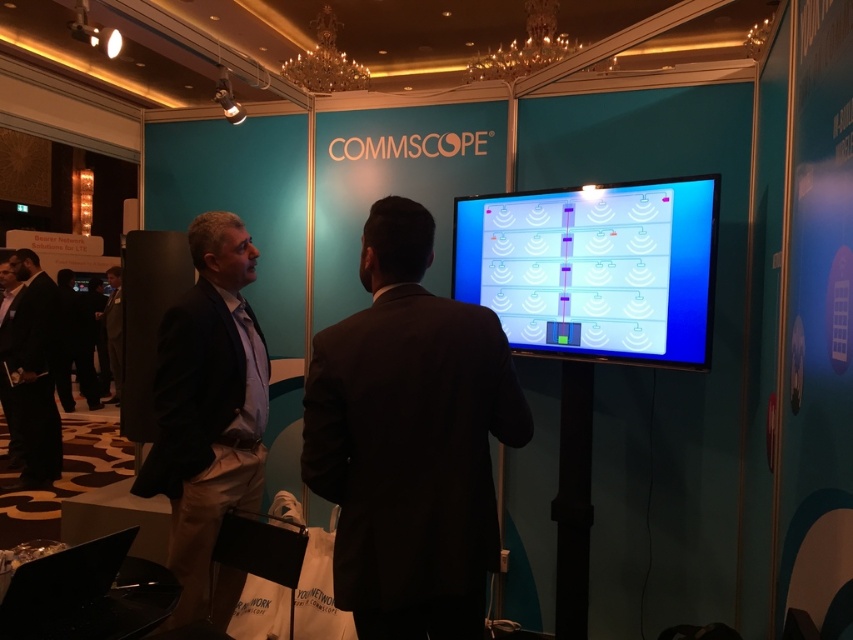
You are a security guard at the trade show and need to ensure that attendees are maintaining a safe distance of at least 3 meters apart. You observe two people wearing dark brown suit at left and black suit at left. Are they complying with the social distancing guidelines?

The distance between the dark brown suit at left and black suit at left is 3.59 meters, which exceeds the required 3 meters. Therefore, they are complying with the social distancing guidelines.

You are at the Commscope booth and want to see the diagram on the blue glossy screen at center while also checking your notes on the black fabric pants at lower left. Can you do both at the same time without moving your head?

The blue glossy screen at center is positioned on the right side of black fabric pants at lower left, so if you are facing the screen, the pants would be to your left. You can see both by glancing sideways without moving your head.

You are a photographer at the event and want to capture a photo of both the dark brown suit at left and the black suit at left. Since you want to highlight their suits, which one should you zoom in on more to make sure their suit detail is clear?

The dark brown suit at left has a lesser width compared to black suit at left, so you should zoom in more on the dark brown suit at left to ensure its details are clear.